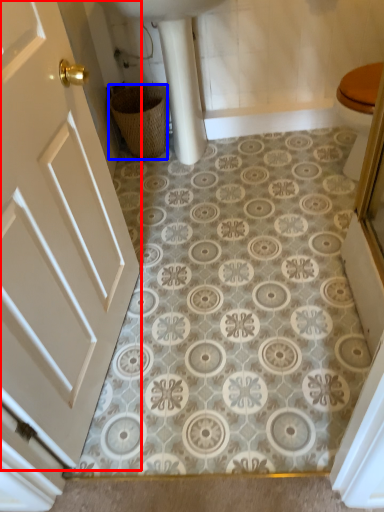
Question: Which point is closer to the camera, door (highlighted by a red box) or basket (highlighted by a blue box)?

Choices:
 (A) door
 (B) basket

Answer: (A)